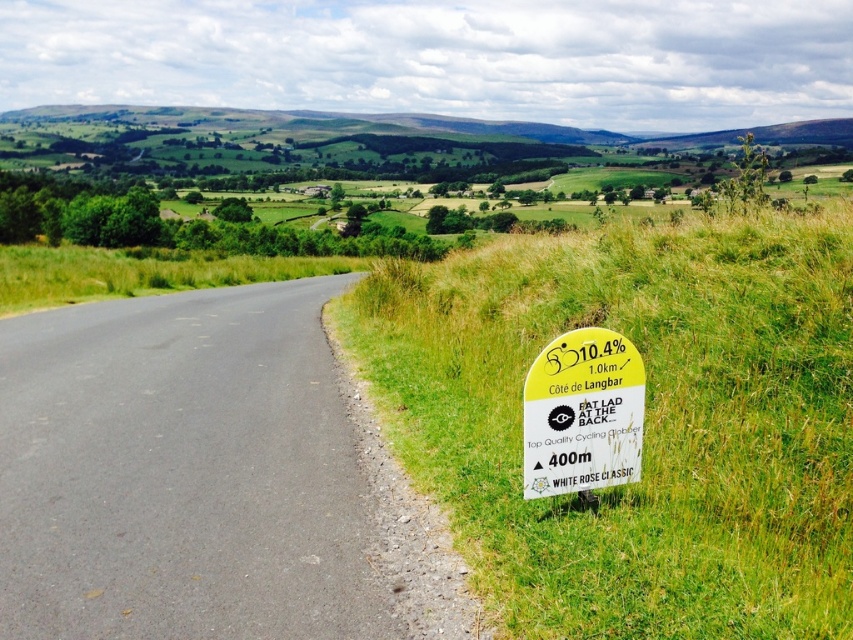
Does green grassy at right have a larger size compared to yellow paper sign at right?

Yes.

In the scene shown: Can you confirm if green grassy at right is taller than yellow paper sign at right?

Correct, green grassy at right is much taller as yellow paper sign at right.

Who is more distant from viewer, (706, 632) or (575, 369)?

Positioned behind is point (575, 369).

Where is `green grassy at right`? This screenshot has width=853, height=640. green grassy at right is located at coordinates (643, 420).